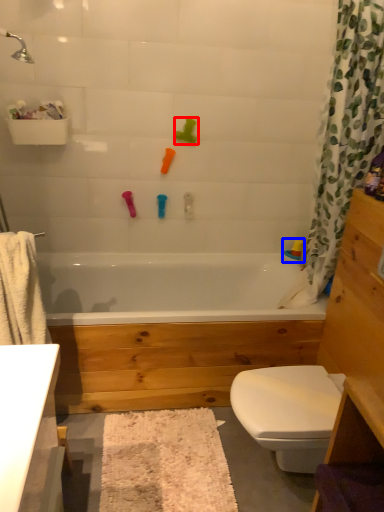
Question: Among these objects, which one is farthest to the camera, toy (highlighted by a red box) or toy (highlighted by a blue box)?

Choices:
 (A) toy
 (B) toy

Answer: (B)